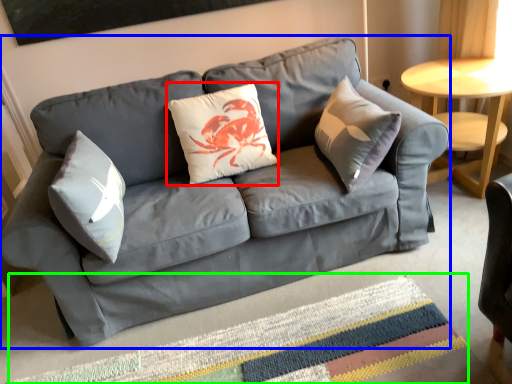
Question: Considering the real-world distances, which object is farthest from pillow (highlighted by a red box)? studio couch (highlighted by a blue box) or mat (highlighted by a green box)?

Choices:
 (A) studio couch
 (B) mat

Answer: (B)